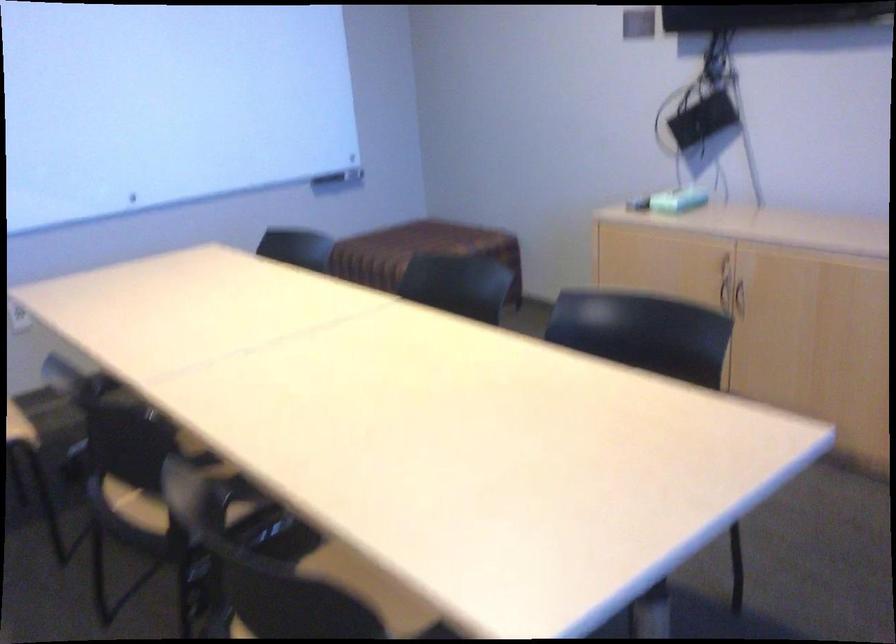
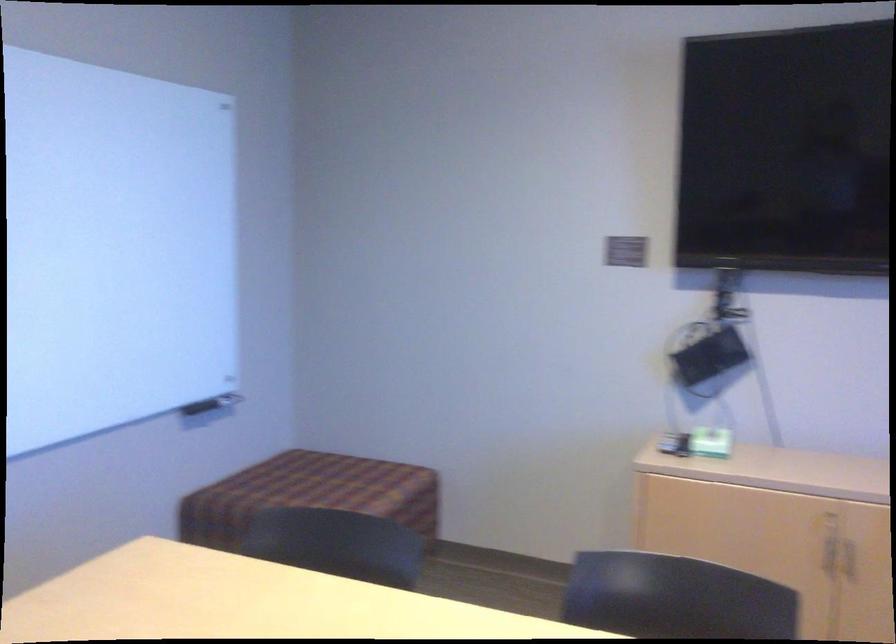
Consider the image. What movement of the cameraman would produce the second image?

The cameraman walked toward left, forward.